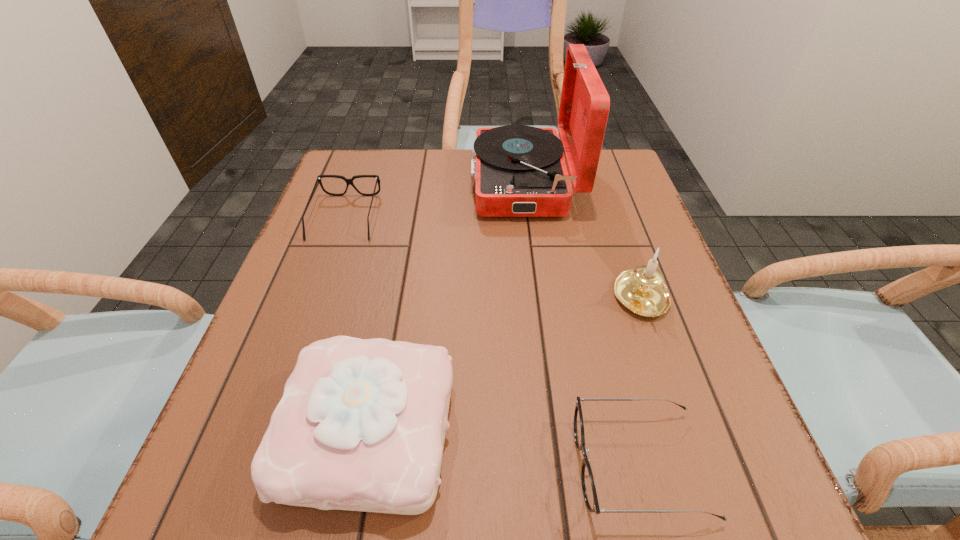
Identify the location of phonograph_record present at the right edge. 519,171.

Identify the location of candle holder situated at the right edge. The height and width of the screenshot is (540, 960). (641, 290).

What are the coordinates of `spectacles present at the right edge` in the screenshot? It's located at [588, 486].

Find the location of a particular element. object present at the far left corner is located at coordinates (348, 181).

This screenshot has width=960, height=540. I want to click on object at the near left corner, so point(361,425).

The image size is (960, 540). In order to click on object that is at the far right corner in this screenshot , I will do `click(519, 171)`.

This screenshot has height=540, width=960. Identify the location of object present at the near right corner. (588, 486).

This screenshot has width=960, height=540. Find the location of `vacant space at the far edge`. vacant space at the far edge is located at coordinates (465, 171).

Image resolution: width=960 pixels, height=540 pixels. I want to click on free space at the near edge of the desktop, so click(x=485, y=476).

This screenshot has height=540, width=960. In the image, there is a desktop. In order to click on free space at the left edge in this screenshot , I will do `click(290, 296)`.